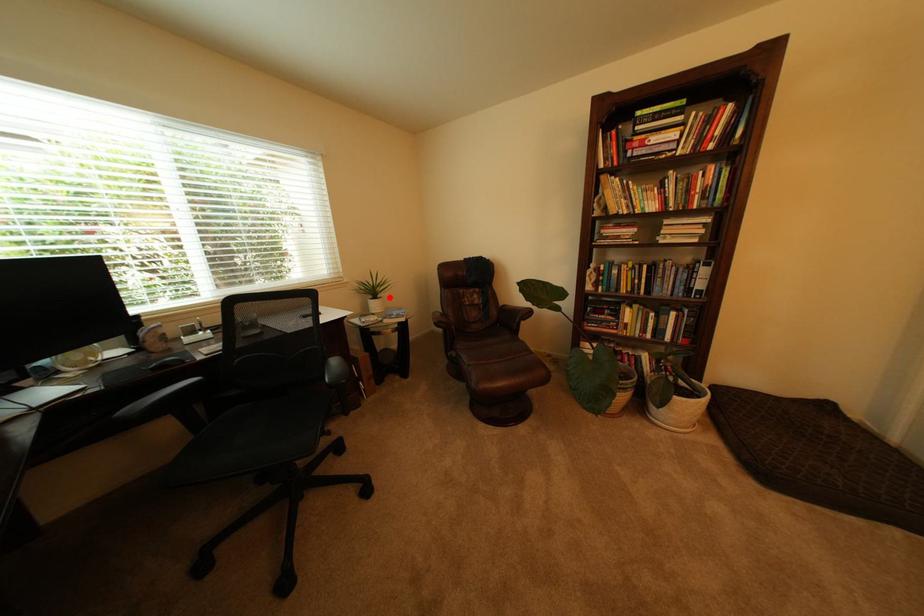
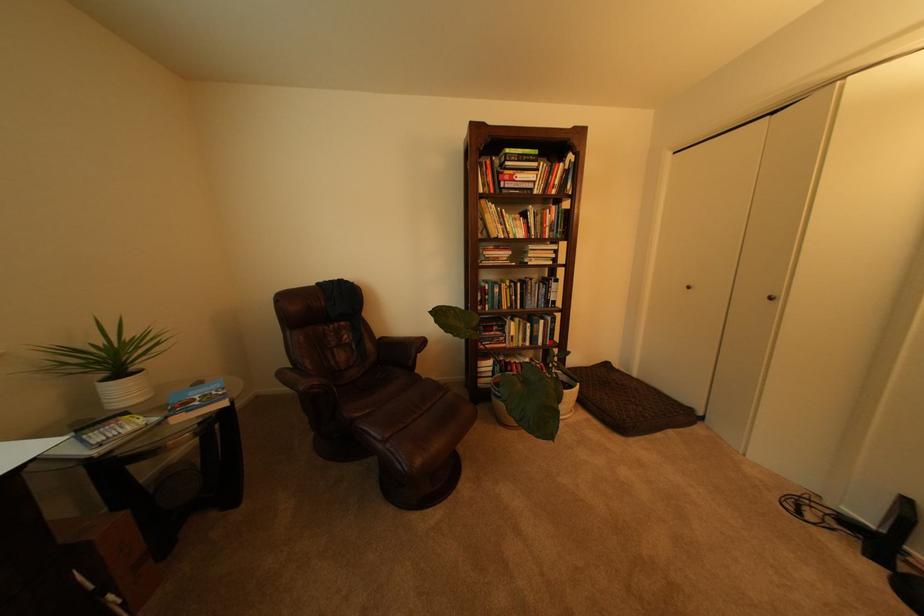
Find the pixel in the second image that matches the highlighted location in the first image.

(143, 370)